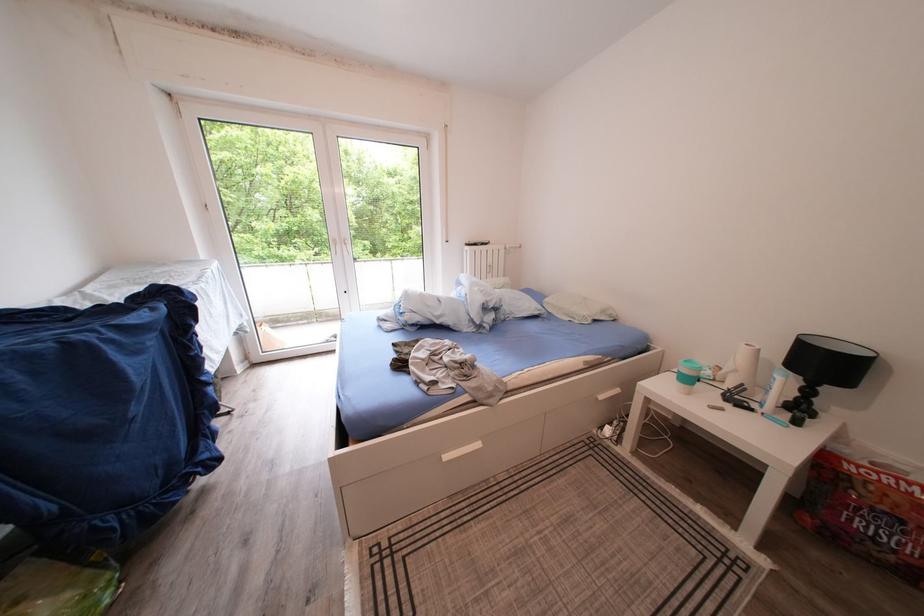
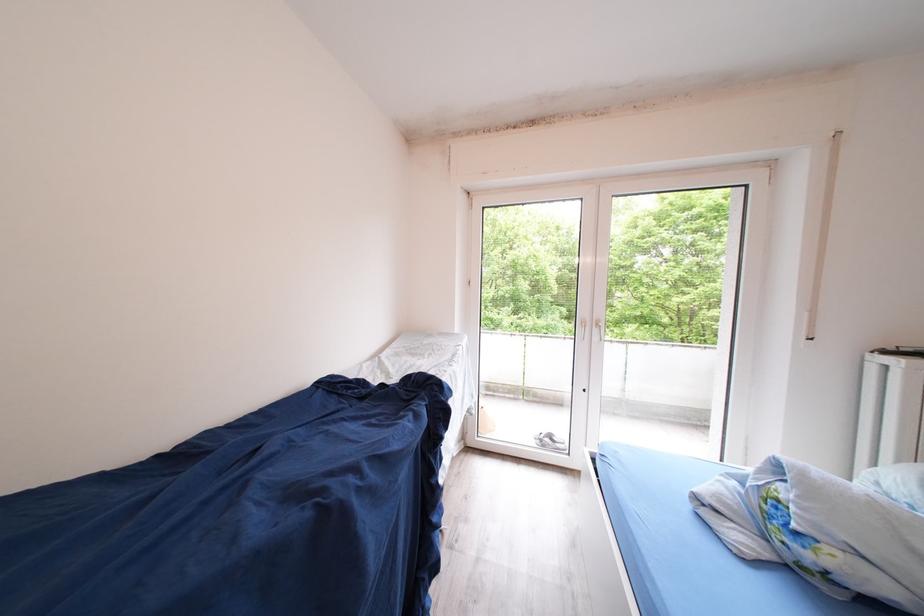
Question: The camera is either moving clockwise (left) or counter-clockwise (right) around the object. The first image is from the beginning of the video and the second image is from the end. Is the camera moving left or right when shooting the video?

Choices:
 (A) Left
 (B) Right

Answer: (B)